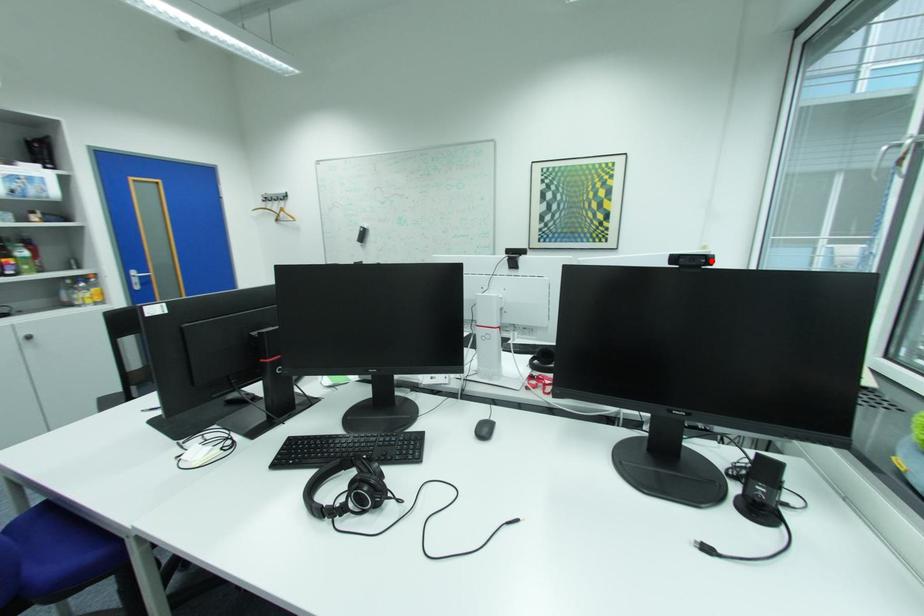
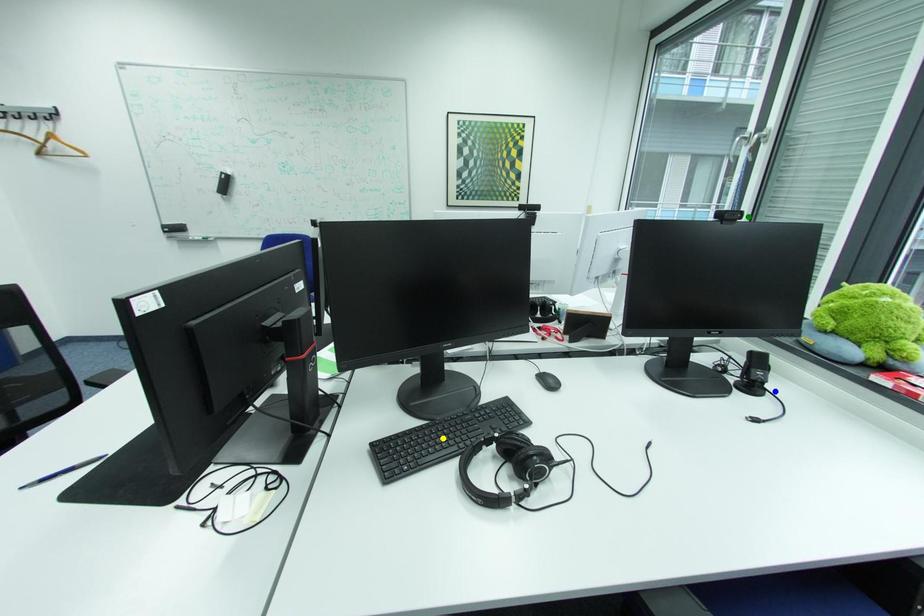
Question: I am providing you with two images of the same scene from different viewpoints. A red point is marked on the first image. You are given multiple points on the second image. In image 2, which mark is for the same physical point as the one in image 1?

Choices:
 (A) yellow point
 (B) blue point
 (C) green point

Answer: (C)